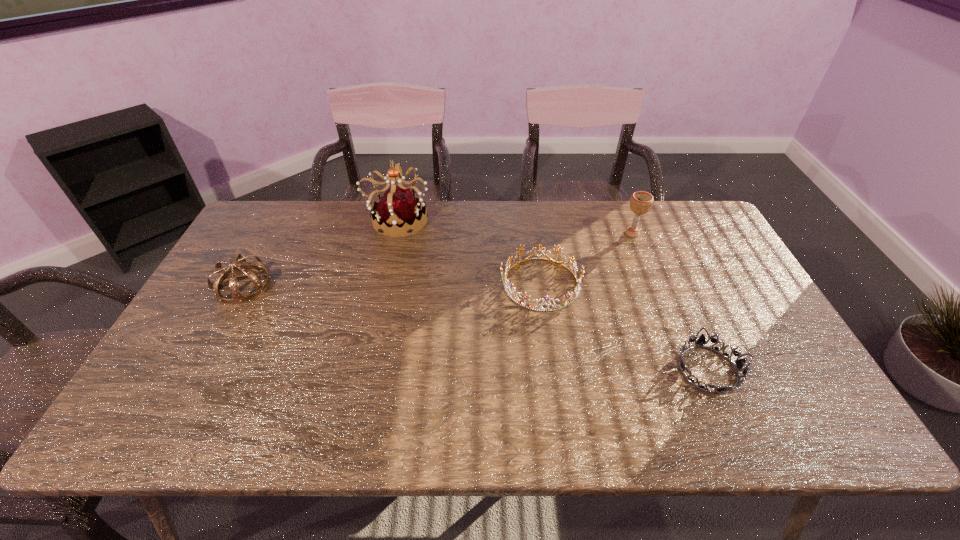
Identify the location of the tallest object. (398, 208).

Image resolution: width=960 pixels, height=540 pixels. Find the location of `the tallest tiara`. the tallest tiara is located at coordinates (398, 208).

Image resolution: width=960 pixels, height=540 pixels. In order to click on the second tallest object in this screenshot , I will do pyautogui.click(x=641, y=202).

This screenshot has height=540, width=960. I want to click on the leftmost tiara, so click(238, 297).

The height and width of the screenshot is (540, 960). Find the location of `the third tallest object`. the third tallest object is located at coordinates (238, 297).

Locate an element on the screen. The image size is (960, 540). the third tiara from left to right is located at coordinates (569, 296).

You are a GUI agent. You are given a task and a screenshot of the screen. Output one action in this format:
    pyautogui.click(x=<x>, y=<y>)
    Task: Click on the third object from right to left
    This screenshot has height=540, width=960.
    Given the screenshot: What is the action you would take?
    pyautogui.click(x=569, y=296)

In order to click on the shortest tiara in this screenshot , I will do `click(701, 341)`.

This screenshot has height=540, width=960. I want to click on the shortest object, so click(x=701, y=341).

Identify the location of blank space located on the front-facing side of the second tiara from left to right. This screenshot has height=540, width=960. (514, 220).